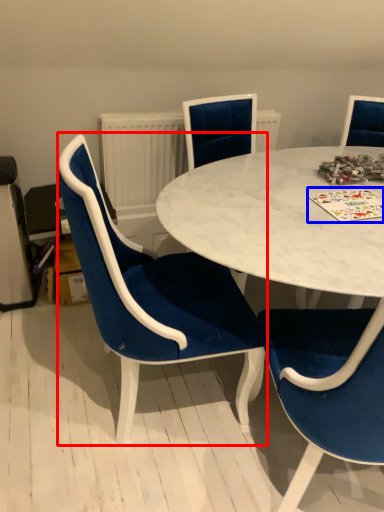
Question: Among these objects, which one is nearest to the camera, chair (highlighted by a red box) or card game (highlighted by a blue box)?

Choices:
 (A) chair
 (B) card game

Answer: (A)